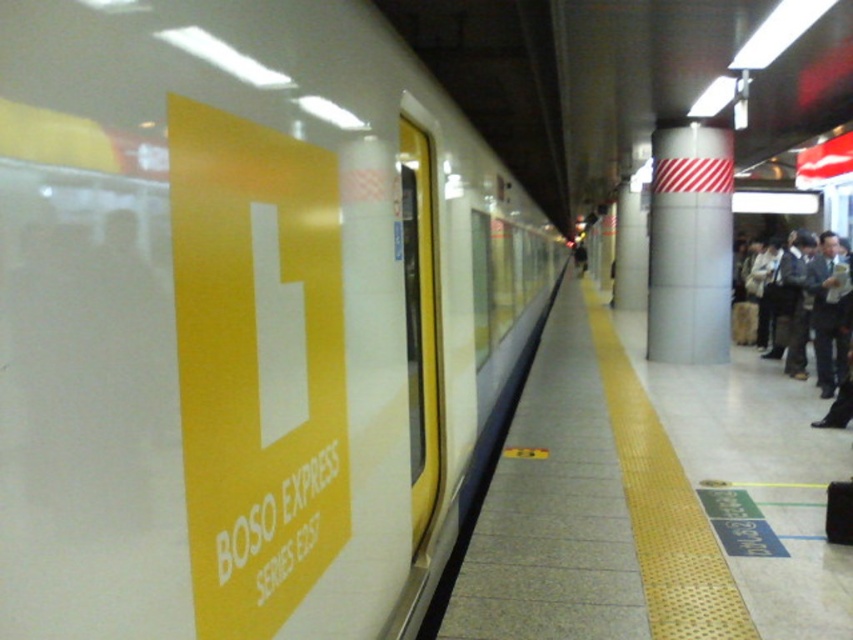
Is yellow rubber platform at center to the right of white glossy pillar at center from the viewer's perspective?

In fact, yellow rubber platform at center is to the left of white glossy pillar at center.

Which is more to the right, yellow rubber platform at center or white glossy pillar at center?

Positioned to the right is white glossy pillar at center.

Find the location of `yellow rubber platform at center`. yellow rubber platform at center is located at coordinates (653, 499).

Is white glossy train at left closer to the viewer compared to yellow rubber platform at center?

That is True.

Which of these two, white glossy train at left or yellow rubber platform at center, stands shorter?

white glossy train at left is shorter.

Who is more forward, (x=154, y=356) or (x=546, y=560)?

Positioned in front is point (x=154, y=356).

Find the location of a particular element. This screenshot has height=640, width=853. white glossy train at left is located at coordinates (241, 317).

Between white glossy train at left and white glossy pillar at center, which one appears on the left side from the viewer's perspective?

From the viewer's perspective, white glossy train at left appears more on the left side.

Can you confirm if white glossy train at left is shorter than white glossy pillar at center?

Indeed, white glossy train at left has a lesser height compared to white glossy pillar at center.

Describe the element at coordinates (241, 317) in the screenshot. I see `white glossy train at left` at that location.

Find the location of a particular element. Image resolution: width=853 pixels, height=640 pixels. white glossy train at left is located at coordinates (241, 317).